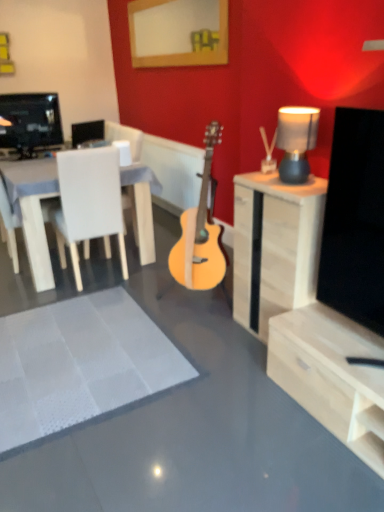
This screenshot has width=384, height=512. I want to click on free space above white textured rug at center (from a real-world perspective), so click(95, 339).